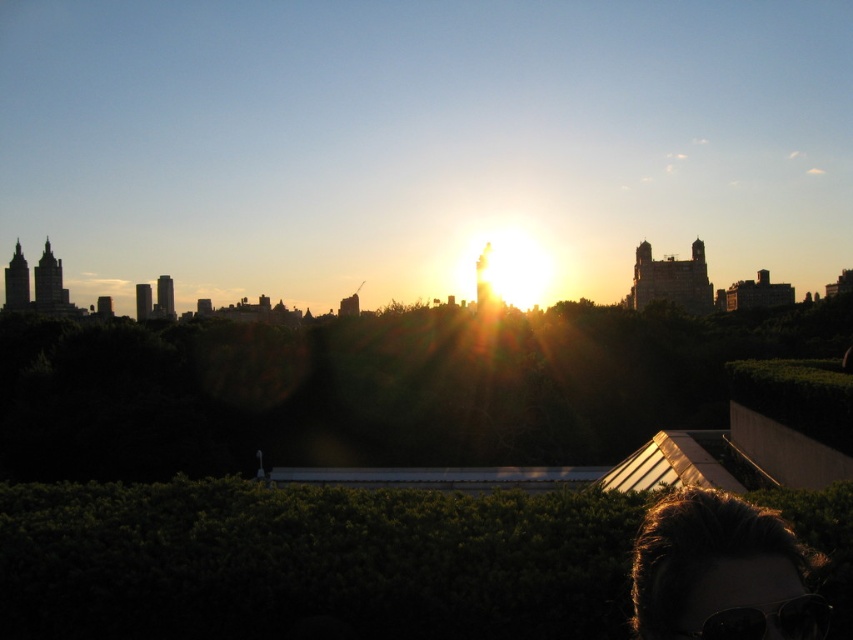
Question: Does dark brown hair at lower right have a greater width compared to black plastic goggles at lower right?

Choices:
 (A) yes
 (B) no

Answer: (A)

Question: Among these objects, which one is farthest from the camera?

Choices:
 (A) black plastic goggles at lower right
 (B) dark brown hair at lower right

Answer: (A)

Question: Is dark brown hair at lower right positioned before black plastic goggles at lower right?

Choices:
 (A) no
 (B) yes

Answer: (B)

Question: Can you confirm if dark brown hair at lower right is positioned below black plastic goggles at lower right?

Choices:
 (A) yes
 (B) no

Answer: (B)